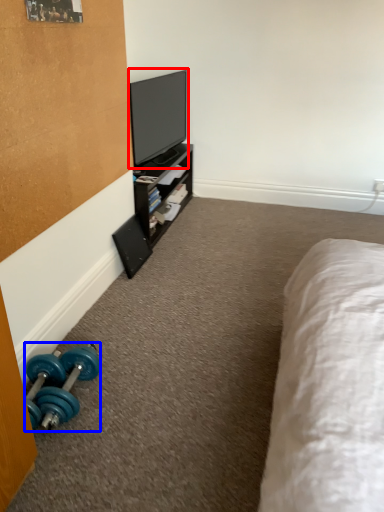
Question: Which point is closer to the camera, television (highlighted by a red box) or dumbbell (highlighted by a blue box)?

Choices:
 (A) television
 (B) dumbbell

Answer: (B)